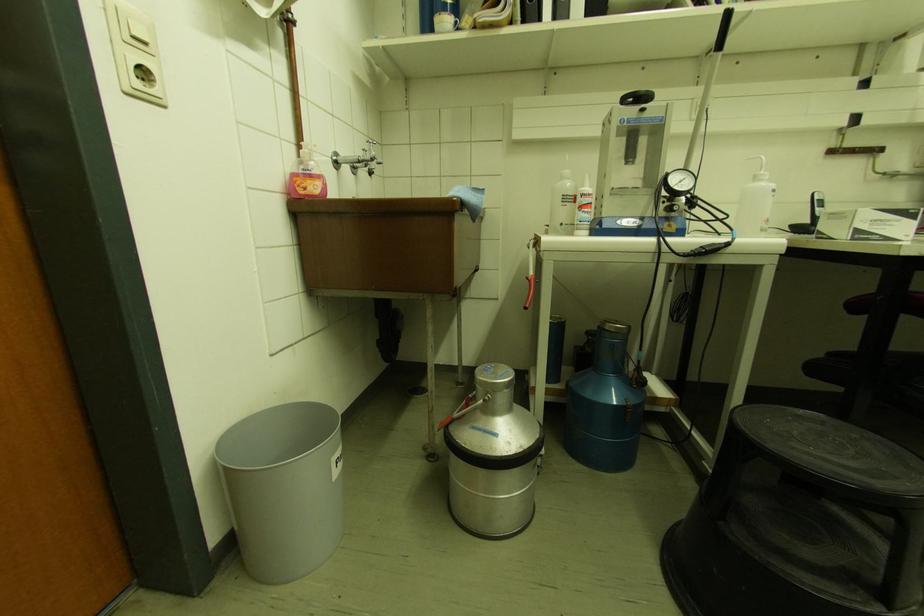
Where would you turn the black adjustment knob? Please return your answer as a coordinate pair (x, y).

(637, 98)